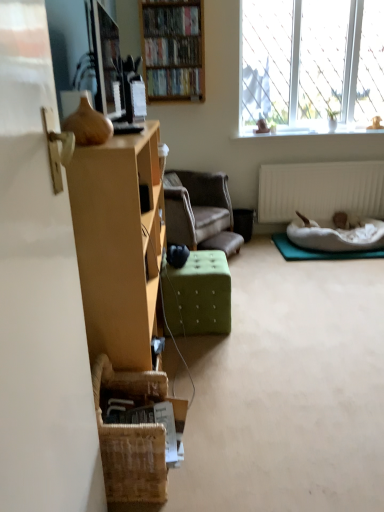
Locate an element on the screen. This screenshot has height=512, width=384. unoccupied area in front of green fabric ottoman at center is located at coordinates (213, 349).